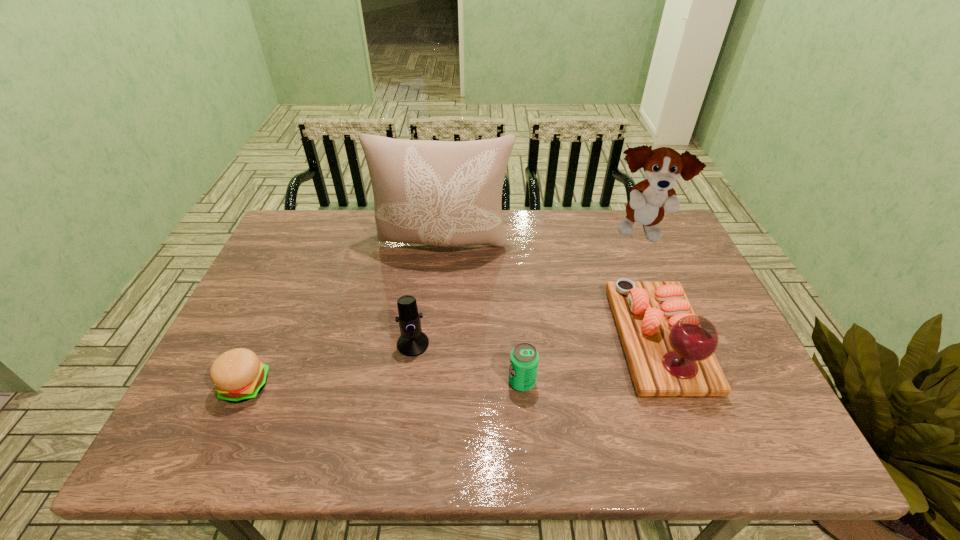
Locate an element on the screen. the tallest object is located at coordinates (445, 193).

The height and width of the screenshot is (540, 960). I want to click on the fifth shortest object, so point(649,199).

This screenshot has height=540, width=960. In order to click on platter in this screenshot , I will do `click(670, 351)`.

Locate an element on the screen. Image resolution: width=960 pixels, height=540 pixels. microphone is located at coordinates (413, 342).

Identify the location of the second shortest object. The image size is (960, 540). (524, 358).

This screenshot has width=960, height=540. What are the coordinates of `hamburger` in the screenshot? It's located at (238, 375).

At what (x,y) coordinates should I click in order to perform the action: click on the leftmost object. Please return your answer as a coordinate pair (x, y). The width and height of the screenshot is (960, 540). Looking at the image, I should click on (238, 375).

This screenshot has height=540, width=960. Identify the location of vacant space located 0.310m on the front side of the cushion. (434, 349).

Image resolution: width=960 pixels, height=540 pixels. I want to click on vacant area located 0.060m on the face of the fifth shortest object, so click(x=654, y=266).

I want to click on vacant area situated 0.160m on the left of the platter, so click(555, 340).